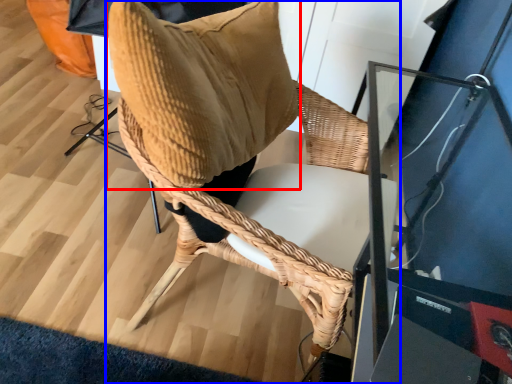
Question: Among these objects, which one is farthest to the camera, bean bag chair (highlighted by a red box) or chair (highlighted by a blue box)?

Choices:
 (A) bean bag chair
 (B) chair

Answer: (B)